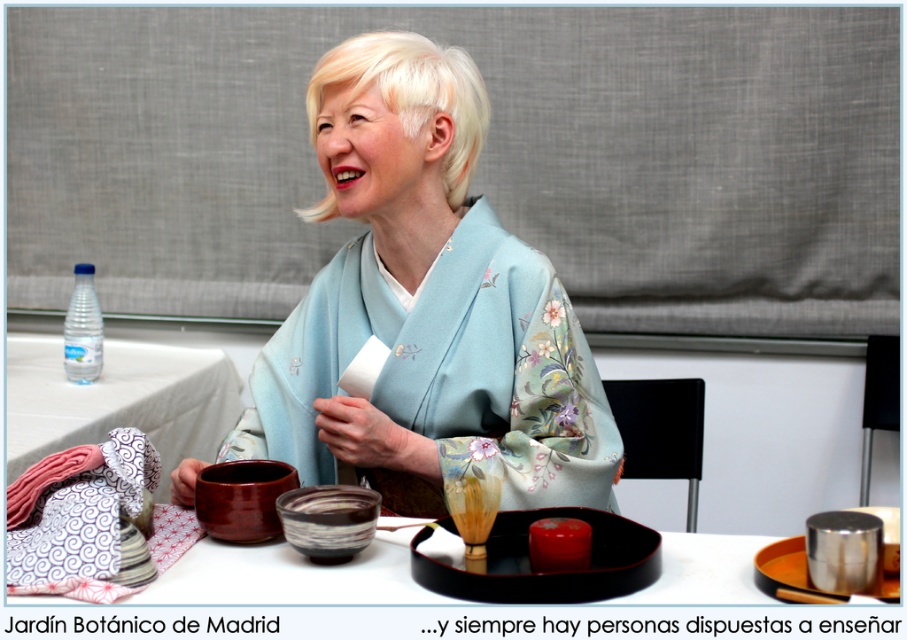
Question: Is light blue silk kimono at center in front of clear plastic bottle at upper left?

Choices:
 (A) yes
 (B) no

Answer: (A)

Question: Which object is the closest to the clear plastic bottle at upper left?

Choices:
 (A) white fabric table at left
 (B) light blue silk kimono at center

Answer: (A)

Question: Which point is closer to the camera?

Choices:
 (A) (28, 353)
 (B) (100, 348)

Answer: (B)

Question: Estimate the real-world distances between objects in this image. Which object is closer to the clear plastic bottle at upper left?

Choices:
 (A) white fabric table at left
 (B) light blue silk kimono at center

Answer: (A)

Question: Is light blue silk kimono at center smaller than clear plastic bottle at upper left?

Choices:
 (A) no
 (B) yes

Answer: (A)

Question: Considering the relative positions of light blue silk kimono at center and white fabric table at left in the image provided, where is light blue silk kimono at center located with respect to white fabric table at left?

Choices:
 (A) right
 (B) left

Answer: (A)